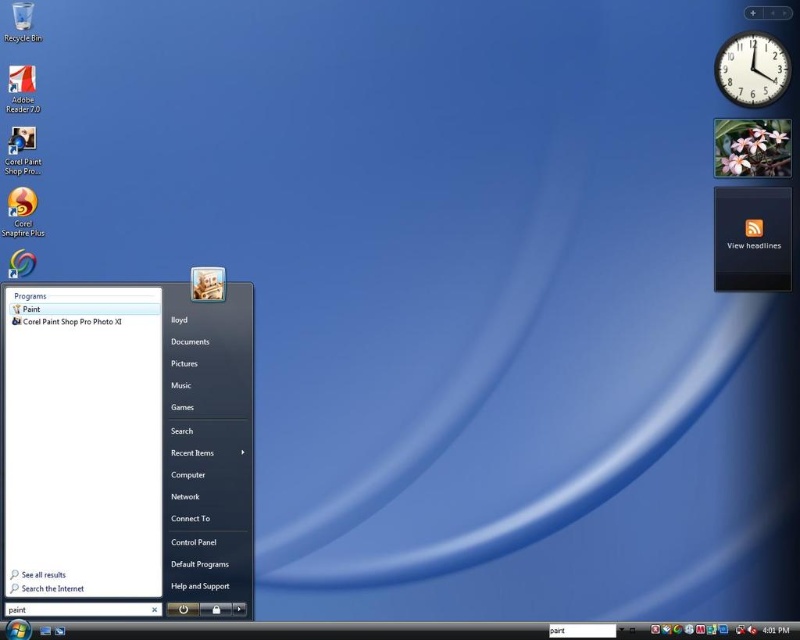
You are using a computer and want to access the settings menu. You see a white matte menu at center and a black plastic clock at upper right. Which object should you click to open the settings menu?

The white matte menu at center is to the left of the black plastic clock at upper right. Since the settings menu is typically accessed through a menu icon, you should click the white matte menu at center.

You are using a computer and notice two items on the screen. One is the white matte menu at center and the other is the black plastic clock at upper right. Which one appears closer to you?

The white matte menu at center appears closer because it is in front of the black plastic clock at upper right.

You are trying to place a new icon on your desktop. The new icon is exactly the same width as the black plastic clock at upper right. Where should you place it so that it doesn not overlap with the white matte menu at center?

Place the new icon to the left or right of the white matte menu at center since the white matte menu at center is wider than the black plastic clock at upper right, so there will be enough space on either side without overlapping.